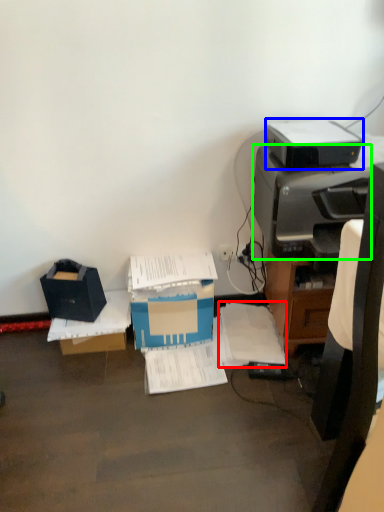
Question: Considering the real-world distances, which object is closest to document (highlighted by a red box)? printer (highlighted by a blue box) or printer (highlighted by a green box).

Choices:
 (A) printer
 (B) printer

Answer: (B)